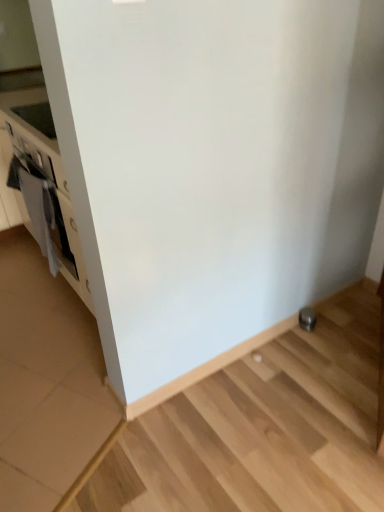
Locate an element on the screen. Image resolution: width=384 pixels, height=512 pixels. white matte oven at left is located at coordinates (41, 208).

What do you see at coordinates (41, 208) in the screenshot? Image resolution: width=384 pixels, height=512 pixels. I see `white matte oven at left` at bounding box center [41, 208].

What is the approximate height of satin silver knob at lower right?

satin silver knob at lower right is 3.27 inches tall.

The width and height of the screenshot is (384, 512). I want to click on satin silver knob at lower right, so click(x=307, y=319).

Measure the distance between satin silver knob at lower right and camera.

satin silver knob at lower right is 1.89 meters away from camera.

The image size is (384, 512). What do you see at coordinates (307, 319) in the screenshot?
I see `satin silver knob at lower right` at bounding box center [307, 319].

Locate an element on the screen. The height and width of the screenshot is (512, 384). white matte oven at left is located at coordinates (41, 208).

In the image, is white matte oven at left on the left side or the right side of satin silver knob at lower right?

From the image, it's evident that white matte oven at left is to the left of satin silver knob at lower right.

In the scene shown: Is white matte oven at left positioned before satin silver knob at lower right?

Yes, white matte oven at left is closer to the camera.

Is point (63, 236) closer or farther from the camera than point (314, 326)?

Clearly, point (63, 236) is closer to the camera than point (314, 326).

From the image's perspective, which is above, white matte oven at left or satin silver knob at lower right?

white matte oven at left appears higher in the image.

From a real-world perspective, between white matte oven at left and satin silver knob at lower right, who is vertically lower?

satin silver knob at lower right.

Is white matte oven at left wider than satin silver knob at lower right?

Indeed, white matte oven at left has a greater width compared to satin silver knob at lower right.

Is white matte oven at left taller or shorter than satin silver knob at lower right?

Clearly, white matte oven at left is taller compared to satin silver knob at lower right.

Between white matte oven at left and satin silver knob at lower right, which one has smaller size?

Smaller between the two is satin silver knob at lower right.

Is white matte oven at left inside the boundaries of satin silver knob at lower right, or outside?

white matte oven at left is not enclosed by satin silver knob at lower right.

Is white matte oven at left placed right next to satin silver knob at lower right?

No, white matte oven at left is not next to satin silver knob at lower right.

Is white matte oven at left facing towards satin silver knob at lower right?

No, white matte oven at left is not oriented towards satin silver knob at lower right.

Consider the image. Can you tell me how much white matte oven at left and satin silver knob at lower right differ in facing direction?

white matte oven at left and satin silver knob at lower right are facing 92 degrees away from each other.

You are a GUI agent. You are given a task and a screenshot of the screen. Output one action in this format:
    pyautogui.click(x=<x>, y=<y>)
    Task: Click on the appliance below the white matte oven at left (from the image's perspective)
    
    Given the screenshot: What is the action you would take?
    pyautogui.click(x=307, y=319)

Is satin silver knob at lower right at the left side of white matte oven at left?

In fact, satin silver knob at lower right is to the right of white matte oven at left.

Does satin silver knob at lower right come in front of white matte oven at left?

No, satin silver knob at lower right is further to the viewer.

Between point (306, 324) and point (49, 254), which one is positioned in front?

The point (306, 324) is closer.

From the image's perspective, which is above, satin silver knob at lower right or white matte oven at left?

white matte oven at left is shown above in the image.

From a real-world perspective, does satin silver knob at lower right sit lower than white matte oven at left?

Correct, in the physical world, satin silver knob at lower right is lower than white matte oven at left.

Which of these two, satin silver knob at lower right or white matte oven at left, is thinner?

satin silver knob at lower right is thinner.

From the picture: Who is taller, satin silver knob at lower right or white matte oven at left?

white matte oven at left.

Which of these two, satin silver knob at lower right or white matte oven at left, is smaller?

satin silver knob at lower right is smaller.

Do you think satin silver knob at lower right is within white matte oven at left, or outside of it?

satin silver knob at lower right is not enclosed by white matte oven at left.

Is satin silver knob at lower right placed right next to white matte oven at left?

No, satin silver knob at lower right is not beside white matte oven at left.

Is satin silver knob at lower right oriented away from white matte oven at left?

satin silver knob at lower right does not have its back to white matte oven at left.

This screenshot has width=384, height=512. I want to click on oven that appears above the satin silver knob at lower right (from a real-world perspective), so click(x=41, y=208).

Locate an element on the screen. This screenshot has height=512, width=384. appliance below the white matte oven at left (from a real-world perspective) is located at coordinates (307, 319).

Identify the location of oven that is above the satin silver knob at lower right (from the image's perspective). (41, 208).